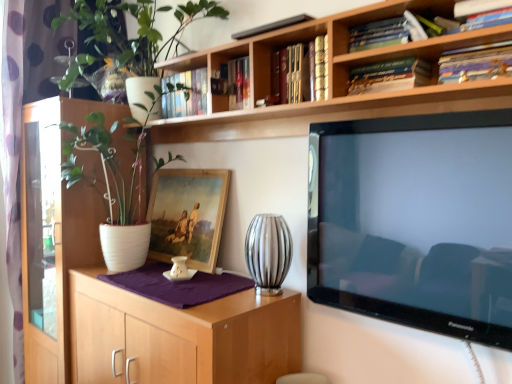
Question: From the image's perspective, is wooden bookshelf at upper center located above or below hardcover book at upper center, arranged as the 1th book when viewed from the left?

Choices:
 (A) above
 (B) below

Answer: (A)

Question: In the image, is wooden bookshelf at upper center positioned in front of or behind hardcover book at upper center, the fourth book when ordered from right to left?

Choices:
 (A) front
 (B) behind

Answer: (A)

Question: Based on their relative distances, which object is nearer to the hardcover books at upper center, which appears as the 2th book when viewed from the left?

Choices:
 (A) wooden cabinet at center
 (B) wooden framed painting at center
 (C) wooden bookshelf at upper center
 (D) silver metallic vase at center
 (E) hardcover book at upper center, which is the 2th book from right to left

Answer: (E)

Question: Which object is the farthest from the hardcover book at upper right, marked as the first book in a right-to-left arrangement?

Choices:
 (A) hardcover book at upper center, which is the 2th book from right to left
 (B) white matte pot at left
 (C) wooden bookshelf at upper center
 (D) white matte pot at upper left
 (E) wooden cabinet at center

Answer: (B)